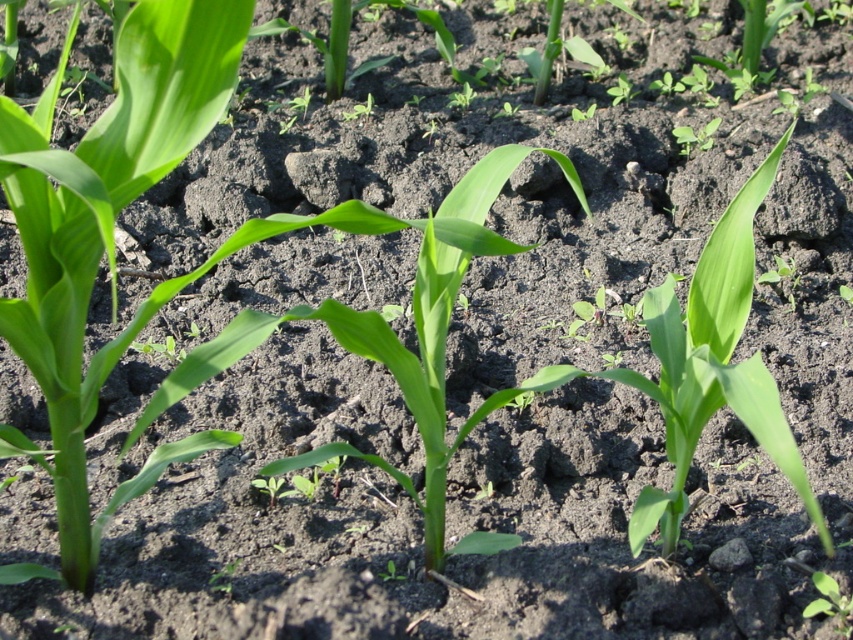
Question: Which point is farther from the camera taking this photo?

Choices:
 (A) (828, 595)
 (B) (473, 172)

Answer: (A)

Question: Does green leafy plant at center appear on the right side of green leafy plant at lower right?

Choices:
 (A) yes
 (B) no

Answer: (B)

Question: Can you confirm if green leafy plant at center is positioned to the left of green leafy plant at lower right?

Choices:
 (A) no
 (B) yes

Answer: (B)

Question: Which point is closer to the camera taking this photo?

Choices:
 (A) (813, 616)
 (B) (469, 198)

Answer: (B)

Question: Where is green leafy plant at center located in relation to green leafy plant at lower right in the image?

Choices:
 (A) above
 (B) below

Answer: (A)

Question: Which point is farther to the camera?

Choices:
 (A) (830, 612)
 (B) (372, 464)

Answer: (B)